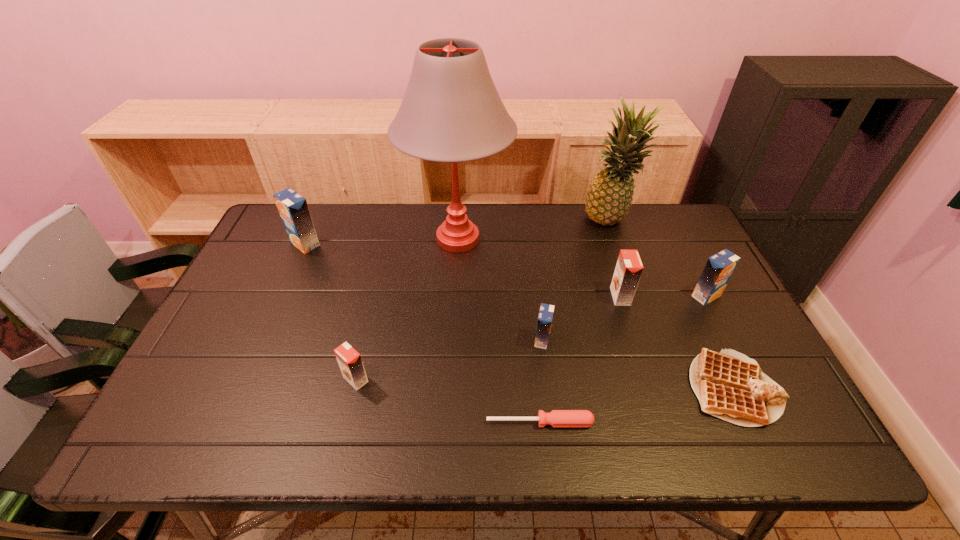
The image size is (960, 540). In order to click on free region located on the front of the right orange orange juice in this screenshot , I will do `click(665, 441)`.

Identify the location of free space located 0.130m on the left of the second farthest blue orange_juice. (645, 296).

Locate an element on the screen. Image resolution: width=960 pixels, height=540 pixels. vacant space located 0.390m on the back of the second nearest orange juice is located at coordinates (529, 238).

Locate an element on the screen. free location located 0.330m on the back of the eighth object from right to left is located at coordinates (380, 275).

I want to click on free space located on the left of the second shortest object, so click(618, 388).

You are a GUI agent. You are given a task and a screenshot of the screen. Output one action in this format:
    pyautogui.click(x=<x>, y=<y>)
    Task: Click on the blank area located on the left of the red screwdriver
    Image resolution: width=960 pixels, height=540 pixels.
    Given the screenshot: What is the action you would take?
    pyautogui.click(x=432, y=422)

Find the location of `table lamp at the far edge`. table lamp at the far edge is located at coordinates (451, 111).

I want to click on pineapple that is at the far edge, so click(x=609, y=195).

Where is `orange_juice located at the far edge`? This screenshot has height=540, width=960. orange_juice located at the far edge is located at coordinates (293, 209).

This screenshot has width=960, height=540. In order to click on waffle that is at the near edge in this screenshot , I will do `click(729, 385)`.